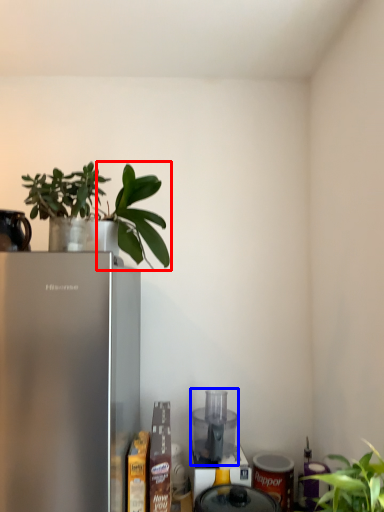
Question: Which point is closer to the camera, plant (highlighted by a red box) or appliance (highlighted by a blue box)?

Choices:
 (A) plant
 (B) appliance

Answer: (A)